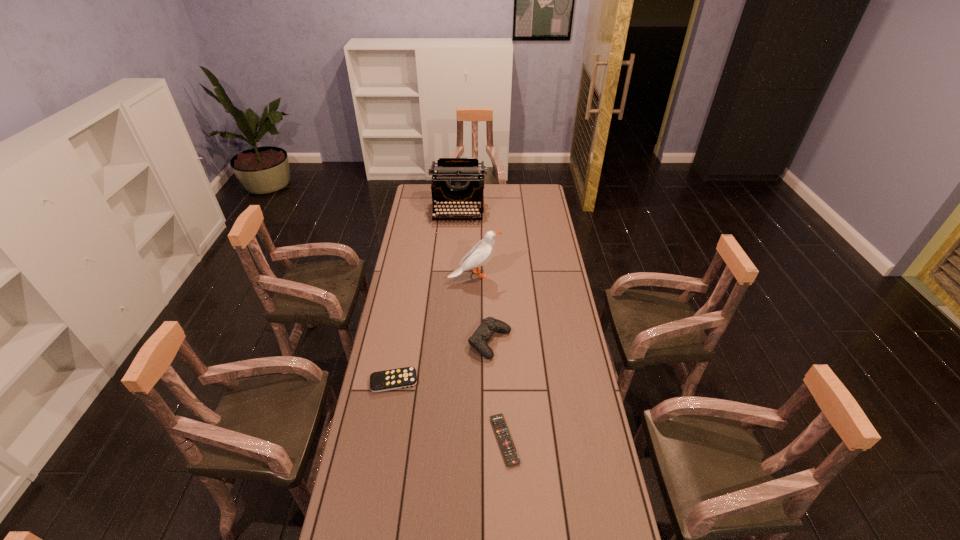
Locate which object is the closest to the fourth tallest object. Please provide its 2D coordinates. Your answer should be formatted as a tuple, i.e. [(x, y)], where the tuple contains the x and y coordinates of a point satisfying the conditions above.

[(489, 325)]

Locate an element on the screen. This screenshot has height=540, width=960. remote control identified as the second closest to the control is located at coordinates (505, 440).

This screenshot has width=960, height=540. Identify the location of free spot that satisfies the following two spatial constraints: 1. on the typing side of the typewriter; 2. on the right side of the control. (450, 342).

At what (x,y) coordinates should I click in order to perform the action: click on vacant point that satisfies the following two spatial constraints: 1. at the beak of the right remote control; 2. on the right side of the gull. Please return your answer as a coordinate pair (x, y). Looking at the image, I should click on (472, 440).

Locate an element on the screen. This screenshot has width=960, height=540. blank area in the image that satisfies the following two spatial constraints: 1. on the back side of the third nearest object; 2. at the beak of the fourth nearest object is located at coordinates (489, 275).

Identify the location of vacant region that satisfies the following two spatial constraints: 1. on the back side of the taller remote control; 2. on the left side of the third tallest object. The image size is (960, 540). (400, 342).

Where is `free region that satisfies the following two spatial constraints: 1. at the beak of the gull; 2. on the right side of the third nearest object`? This screenshot has height=540, width=960. free region that satisfies the following two spatial constraints: 1. at the beak of the gull; 2. on the right side of the third nearest object is located at coordinates (473, 342).

The image size is (960, 540). Find the location of `free space that satisfies the following two spatial constraints: 1. at the beak of the right remote control; 2. on the right side of the fourth nearest object`. free space that satisfies the following two spatial constraints: 1. at the beak of the right remote control; 2. on the right side of the fourth nearest object is located at coordinates (472, 440).